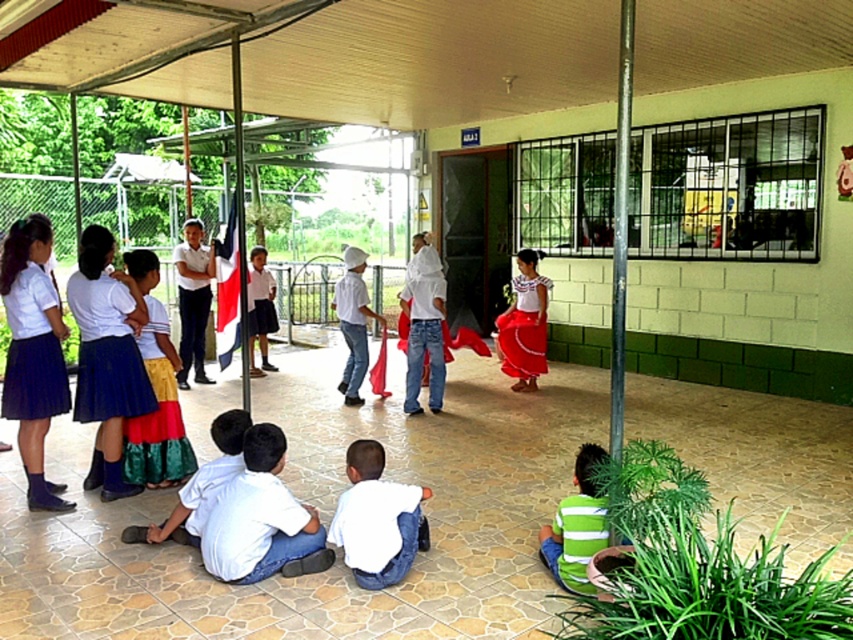
Question: Which is farther from the white cotton shirt at center?

Choices:
 (A) red satin skirt at center
 (B) white matte shirt at lower center
 (C) metallic corrugated roof at upper center
 (D) shiny satin skirt at left

Answer: (B)

Question: Does shiny satin skirt at left come behind white matte shirt at center?

Choices:
 (A) yes
 (B) no

Answer: (B)

Question: Among these points, which one is nearest to the camera?

Choices:
 (A) (45, 346)
 (B) (578, 560)
 (C) (518, 336)
 (D) (160, 317)

Answer: (B)

Question: Among these objects, which one is nearest to the camera?

Choices:
 (A) red satin skirt at center
 (B) metallic corrugated roof at upper center
 (C) green striped shirt at lower right

Answer: (C)

Question: Does white matte shirt at lower center have a smaller size compared to blue pleated skirt at left?

Choices:
 (A) no
 (B) yes

Answer: (A)

Question: Observing the image, what is the correct spatial positioning of white matte shirt at lower center in reference to red satin skirt at center?

Choices:
 (A) above
 (B) below

Answer: (B)